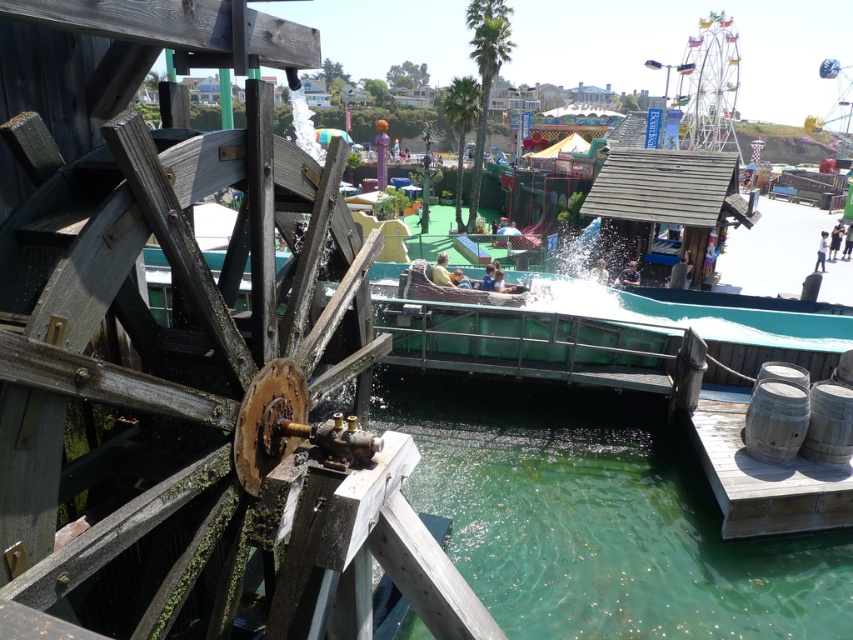
Question: Among these objects, which one is farthest from the camera?

Choices:
 (A) rusty wood waterwheel at left
 (B) metallic ferris wheel at upper right
 (C) wooden barrels at lower right
 (D) green translucent water at lower center

Answer: (B)

Question: From the image, what is the correct spatial relationship of rusty wood waterwheel at left in relation to metallic ferris wheel at upper right?

Choices:
 (A) right
 (B) left

Answer: (B)

Question: Which point is farther from the camera taking this photo?

Choices:
 (A) (834, 557)
 (B) (717, 36)

Answer: (B)

Question: Is wooden barrels at lower right positioned in front of metallic ferris wheel at upper right?

Choices:
 (A) yes
 (B) no

Answer: (A)

Question: Which object is the farthest from the rusty wood waterwheel at left?

Choices:
 (A) metallic ferris wheel at upper right
 (B) wooden barrels at lower right
 (C) green translucent water at lower center

Answer: (A)

Question: Is green translucent water at lower center thinner than metallic ferris wheel at upper right?

Choices:
 (A) no
 (B) yes

Answer: (B)